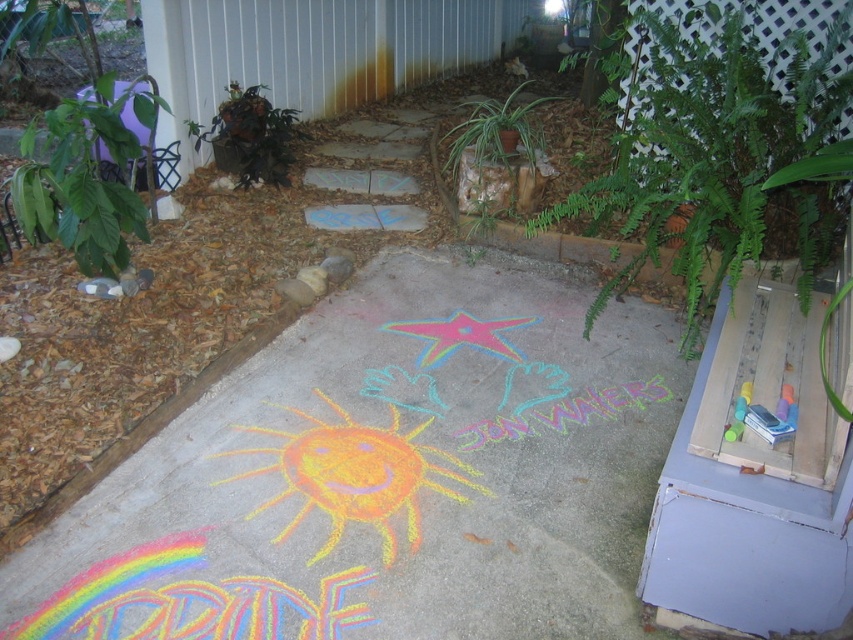
Is green leafy plant at left wider than green leafy plant at center?

In fact, green leafy plant at left might be narrower than green leafy plant at center.

Who is more distant from viewer, (80, 262) or (494, 106)?

The point (494, 106) is behind.

What do you see at coordinates (85, 177) in the screenshot? This screenshot has width=853, height=640. I see `green leafy plant at left` at bounding box center [85, 177].

You are a GUI agent. You are given a task and a screenshot of the screen. Output one action in this format:
    pyautogui.click(x=<x>, y=<y>)
    Task: Click on the green leafy plant at left
    The height and width of the screenshot is (640, 853).
    Given the screenshot: What is the action you would take?
    pyautogui.click(x=85, y=177)

Is green leafy plant at upper right closer to the viewer compared to rainbow chalk at lower left?

No, it is not.

Can you confirm if green leafy plant at upper right is shorter than rainbow chalk at lower left?

In fact, green leafy plant at upper right may be taller than rainbow chalk at lower left.

Does point (653, 116) come in front of point (294, 596)?

No, (653, 116) is behind (294, 596).

You are a GUI agent. You are given a task and a screenshot of the screen. Output one action in this format:
    pyautogui.click(x=<x>, y=<y>)
    Task: Click on the green leafy plant at upper right
    This screenshot has width=853, height=640.
    Given the screenshot: What is the action you would take?
    pyautogui.click(x=718, y=147)

Which is more to the right, rainbow chalk at lower left or green leafy plant at left?

rainbow chalk at lower left

Does point (329, 637) come behind point (96, 198)?

That is False.

What are the coordinates of `rainbow chalk at lower left` in the screenshot? It's located at (189, 600).